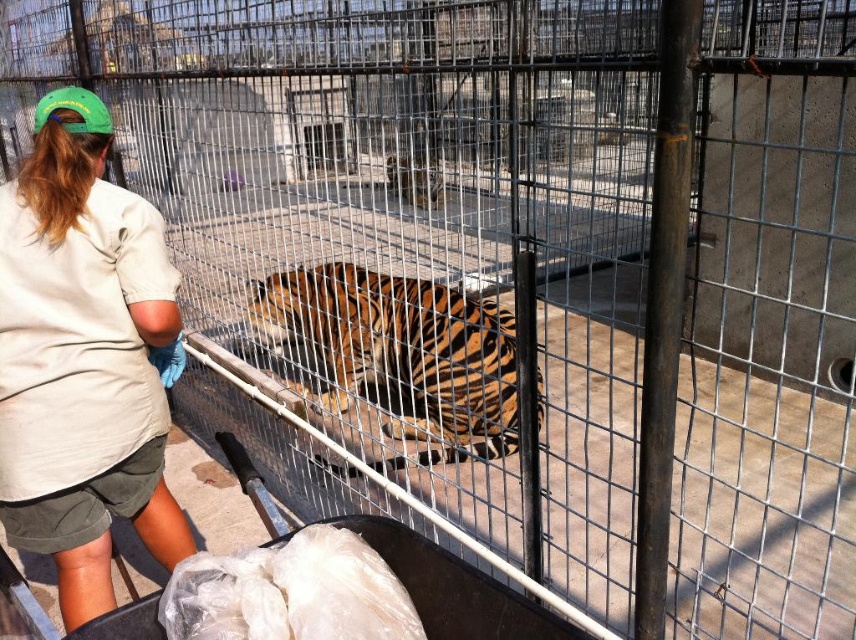
Is beige cotton shirt at center smaller than orange-brown striped tiger at center?

Indeed, beige cotton shirt at center has a smaller size compared to orange-brown striped tiger at center.

Can you confirm if beige cotton shirt at center is bigger than orange-brown striped tiger at center?

Actually, beige cotton shirt at center might be smaller than orange-brown striped tiger at center.

Is point (153, 451) less distant than point (458, 292)?

Yes.

Locate an element on the screen. beige cotton shirt at center is located at coordinates (82, 356).